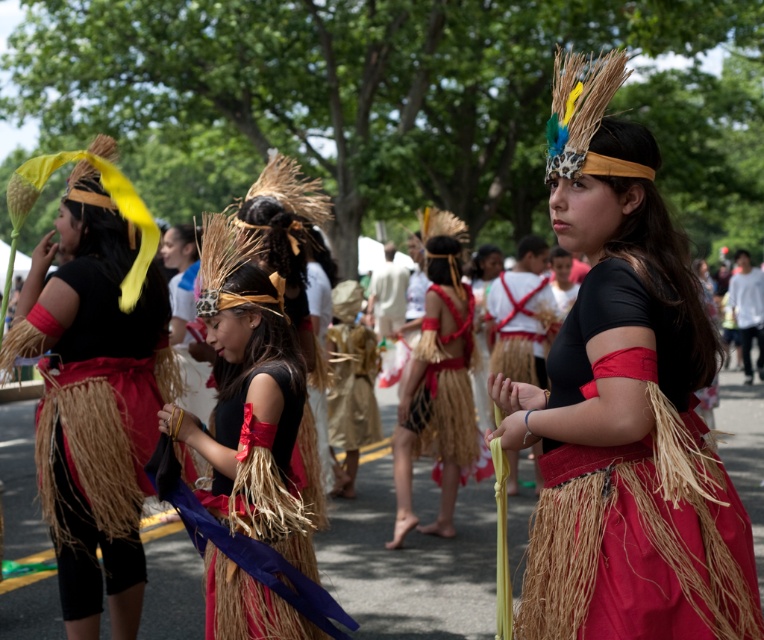
Is matte straw headdress at left taller than matte straw skirt at center?

Incorrect, matte straw headdress at left's height is not larger of matte straw skirt at center's.

Who is lower down, matte straw headdress at left or matte straw skirt at center?

matte straw headdress at left

Locate an element on the screen. The width and height of the screenshot is (764, 640). matte straw headdress at left is located at coordinates (96, 381).

Does raffia skirt at center lie in front of matte straw skirt at center?

That is True.

Which of these two, raffia skirt at center or matte straw skirt at center, stands taller?

matte straw skirt at center is taller.

The height and width of the screenshot is (640, 764). What are the coordinates of `raffia skirt at center` in the screenshot? It's located at (251, 474).

Between point (612, 211) and point (143, 346), which one is positioned behind?

The point (143, 346) is more distant.

Is matte black top at center above matte straw headdress at left?

Indeed, matte black top at center is positioned over matte straw headdress at left.

Between point (565, 61) and point (62, 280), which one is positioned behind?

Positioned behind is point (62, 280).

The image size is (764, 640). I want to click on matte black top at center, so click(623, 404).